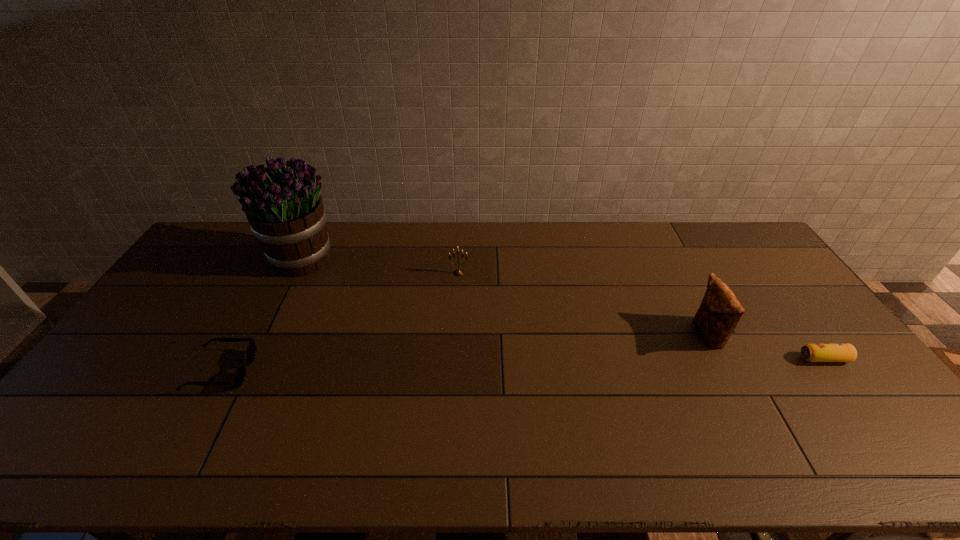
The image size is (960, 540). In order to click on vacant space located 0.360m on the open side of the fourth shortest object in this screenshot , I will do `click(572, 335)`.

Where is `vacant point located on the left of the candelabrum`? The height and width of the screenshot is (540, 960). vacant point located on the left of the candelabrum is located at coordinates (432, 273).

I want to click on vacant area situated 0.370m at the front lenses of the sunglasses, so click(386, 370).

Identify the location of blank space located 0.260m on the back of the rightmost object. (773, 289).

Identify the location of object located at the far edge. (282, 203).

You are a GUI agent. You are given a task and a screenshot of the screen. Output one action in this format:
    pyautogui.click(x=<x>, y=<y>)
    Task: Click on the object located at the right edge
    The image size is (960, 540).
    Given the screenshot: What is the action you would take?
    pyautogui.click(x=811, y=352)

Where is `free region at the far edge of the desktop`? Image resolution: width=960 pixels, height=540 pixels. free region at the far edge of the desktop is located at coordinates (250, 261).

Where is `vacant space at the near edge of the desktop`? vacant space at the near edge of the desktop is located at coordinates (335, 438).

Identify the location of vacant space at the left edge of the desktop. This screenshot has height=540, width=960. tap(142, 353).

I want to click on vacant space at the right edge of the desktop, so click(846, 403).